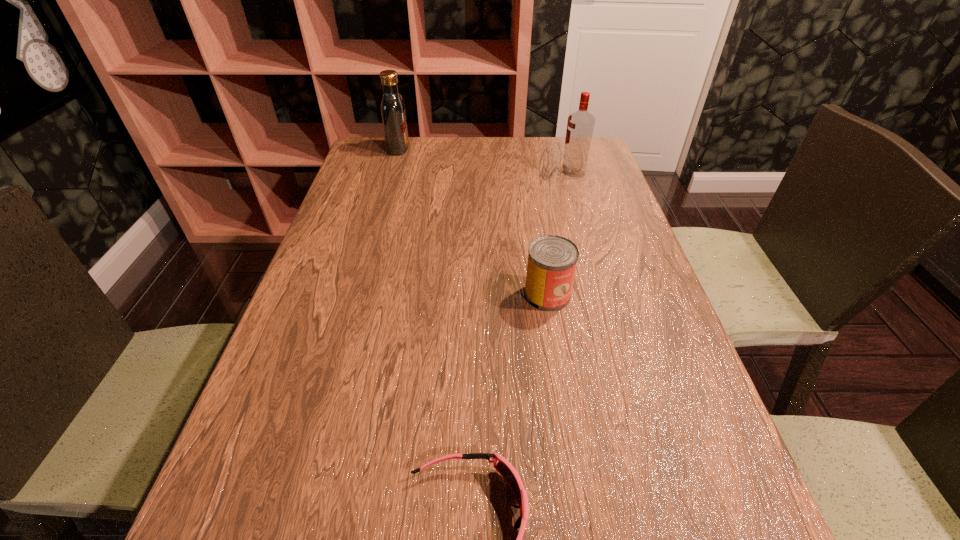
Locate an element on the screen. This screenshot has width=960, height=540. free spot between the second farthest object and the third farthest object is located at coordinates (561, 234).

This screenshot has height=540, width=960. I want to click on free space between the nearer vodka and the farther vodka, so click(x=486, y=161).

The width and height of the screenshot is (960, 540). Identify the location of free space between the third tallest object and the farthest object. (473, 221).

Identify which object is located as the third nearest to the leftmost object. Please provide its 2D coordinates. Your answer should be formatted as a tuple, i.e. [(x, y)], where the tuple contains the x and y coordinates of a point satisfying the conditions above.

[(502, 465)]

Image resolution: width=960 pixels, height=540 pixels. In order to click on object that is the second closest to the third tallest object in this screenshot , I will do `click(580, 125)`.

Where is `free space in the image that satisfies the following two spatial constraints: 1. on the front-facing side of the second nearest object; 2. on the left side of the leftmost object`? This screenshot has width=960, height=540. free space in the image that satisfies the following two spatial constraints: 1. on the front-facing side of the second nearest object; 2. on the left side of the leftmost object is located at coordinates (356, 295).

Where is `free space that satisfies the following two spatial constraints: 1. on the front-facing side of the second nearest object; 2. on the left side of the leftmost object`? Image resolution: width=960 pixels, height=540 pixels. free space that satisfies the following two spatial constraints: 1. on the front-facing side of the second nearest object; 2. on the left side of the leftmost object is located at coordinates (356, 295).

Image resolution: width=960 pixels, height=540 pixels. I want to click on vacant space that satisfies the following two spatial constraints: 1. on the front-facing side of the third tallest object; 2. on the right side of the farthest object, so click(x=356, y=295).

In order to click on vacant position in the image that satisfies the following two spatial constraints: 1. on the front-facing side of the farthest object; 2. on the right side of the second object from right to left in this screenshot , I will do `click(356, 295)`.